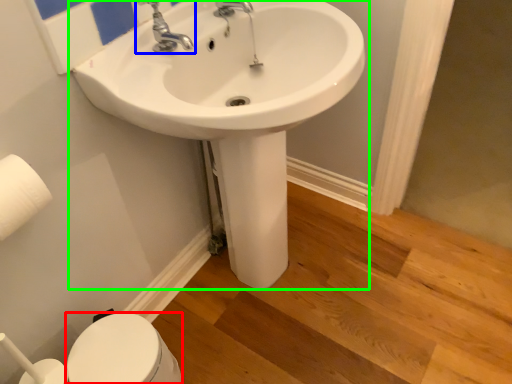
Question: Which object is the closest to the bidet (highlighted by a red box)? Choose among these: tap (highlighted by a blue box) or sink (highlighted by a green box).

Choices:
 (A) tap
 (B) sink

Answer: (B)